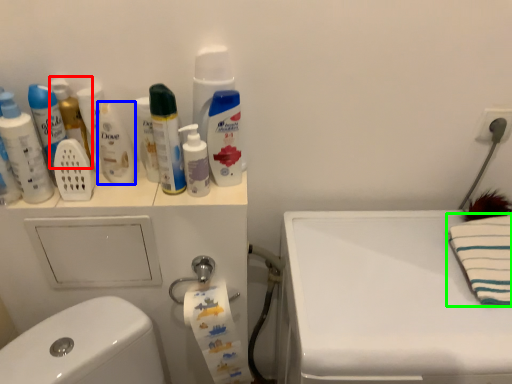
Question: Which is farther away from mouthwash (highlighted by a red box)? mouthwash (highlighted by a blue box) or beach towel (highlighted by a green box)?

Choices:
 (A) mouthwash
 (B) beach towel

Answer: (B)